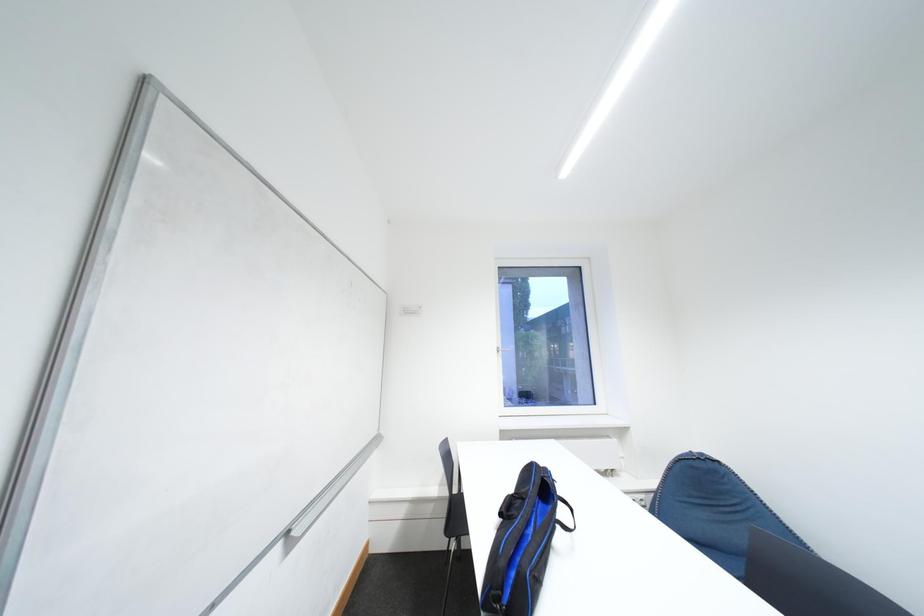
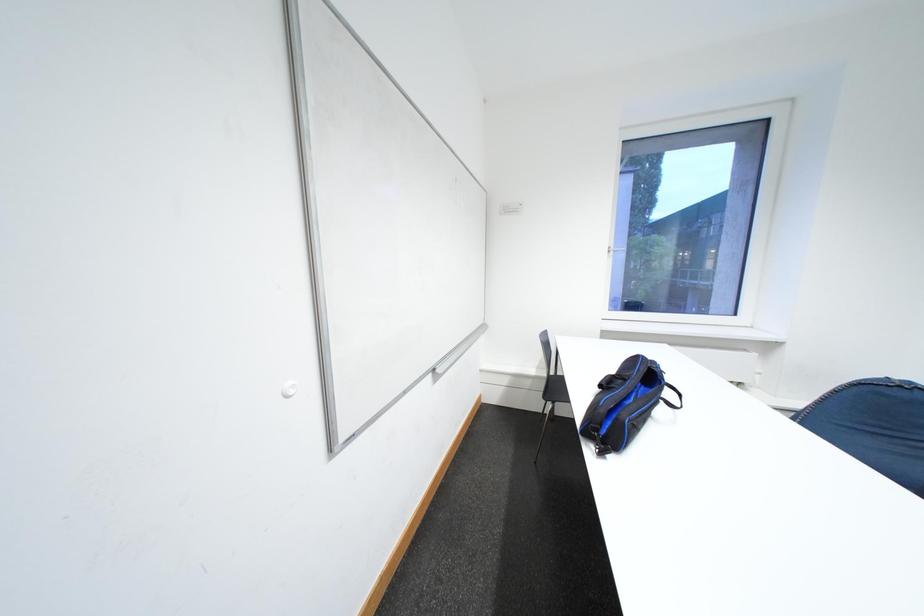
How did the camera likely rotate?

The camera's rotation is toward left-down.